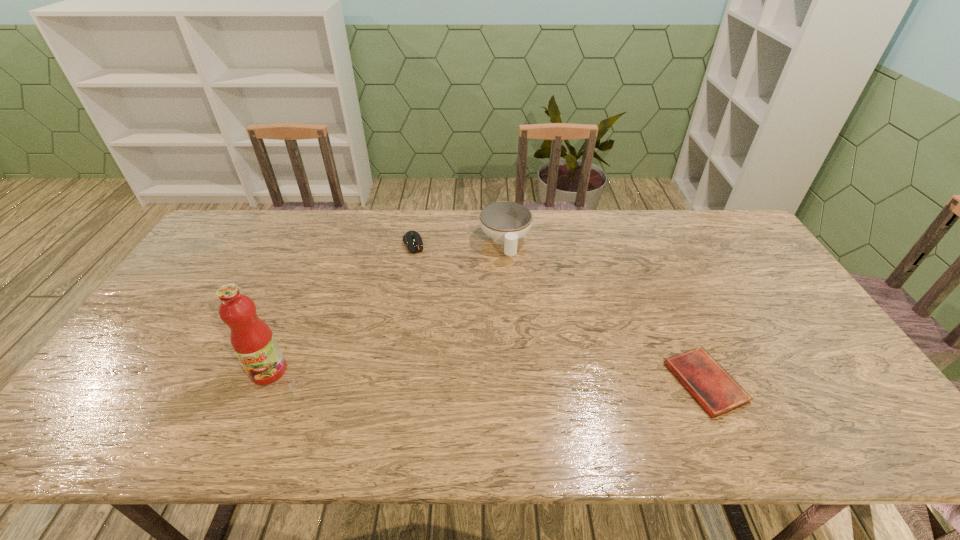
The image size is (960, 540). Find the location of `fruit juice`. fruit juice is located at coordinates (252, 340).

Image resolution: width=960 pixels, height=540 pixels. What are the coordinates of `the leftmost object` in the screenshot? It's located at (252, 340).

Image resolution: width=960 pixels, height=540 pixels. I want to click on the rightmost object, so click(709, 383).

The image size is (960, 540). Identify the location of the shortest object. (709, 383).

Locate an element on the screen. The width and height of the screenshot is (960, 540). computer equipment is located at coordinates [x=413, y=240].

This screenshot has height=540, width=960. I want to click on the third tallest object, so click(x=413, y=240).

You are a GUI agent. You are given a task and a screenshot of the screen. Output one action in this format:
    pyautogui.click(x=<x>, y=<y>)
    Task: Click on the third object from left to right
    
    Given the screenshot: What is the action you would take?
    pyautogui.click(x=506, y=222)

This screenshot has width=960, height=540. What are the coordinates of `the third shortest object` in the screenshot? It's located at (506, 222).

The image size is (960, 540). Find the location of `vacant region located on the back of the shortest object`. vacant region located on the back of the shortest object is located at coordinates (662, 288).

Find the location of a particular element. Image resolution: width=960 pixels, height=540 pixels. vacant point located 0.300m on the button of the computer equipment is located at coordinates (437, 318).